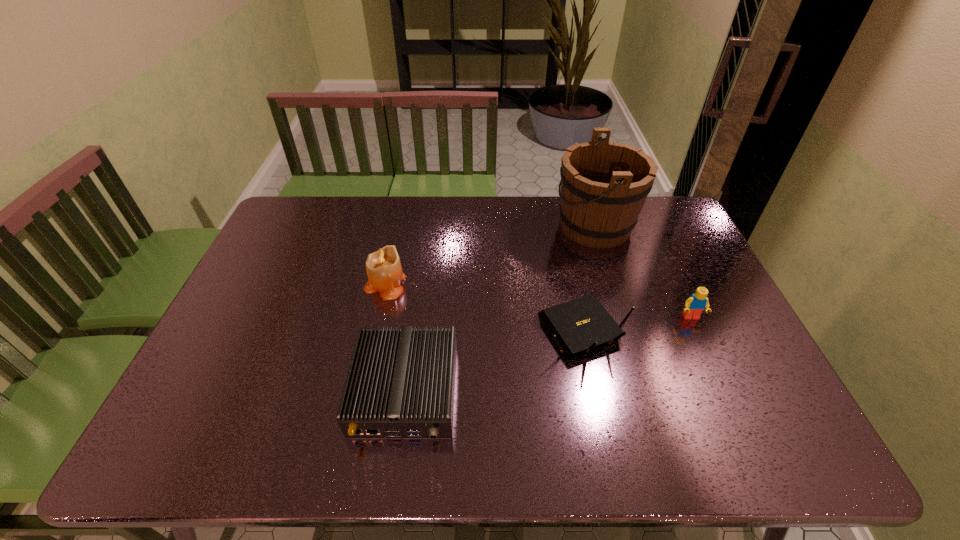
Where is `vacant space situated on the front-facing side of the rightmost object`? The image size is (960, 540). vacant space situated on the front-facing side of the rightmost object is located at coordinates (742, 430).

Locate an element on the screen. vacant space situated 0.110m on the back of the right router is located at coordinates (571, 272).

Image resolution: width=960 pixels, height=540 pixels. I want to click on object at the far edge, so click(x=604, y=185).

I want to click on object positioned at the near edge, so click(x=400, y=383).

Where is `object at the right edge`? This screenshot has height=540, width=960. object at the right edge is located at coordinates (697, 302).

At what (x,y) coordinates should I click in order to perform the action: click on vacant space at the far edge of the desktop. Please return your answer as a coordinate pair (x, y). The width and height of the screenshot is (960, 540). Looking at the image, I should click on (545, 201).

Identify the location of free region at the near edge. The width and height of the screenshot is (960, 540). (722, 456).

Image resolution: width=960 pixels, height=540 pixels. Find the location of `free space at the left edge of the desktop`. free space at the left edge of the desktop is located at coordinates (199, 367).

In the image, there is a desktop. Where is `vacant area at the right edge`? vacant area at the right edge is located at coordinates [x=712, y=358].

I want to click on free space between the left router and the tallest object, so click(500, 308).